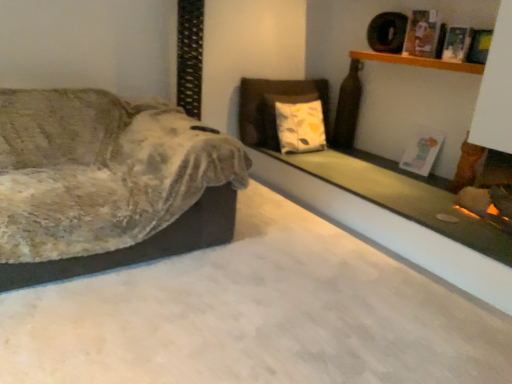
Question: Is velvet fabric couch at left to the right of green matte glass at upper right from the viewer's perspective?

Choices:
 (A) no
 (B) yes

Answer: (A)

Question: Considering the relative sizes of velvet fabric couch at left and green matte glass at upper right in the image provided, is velvet fabric couch at left smaller than green matte glass at upper right?

Choices:
 (A) no
 (B) yes

Answer: (A)

Question: Are velvet fabric couch at left and green matte glass at upper right located far from each other?

Choices:
 (A) yes
 (B) no

Answer: (A)

Question: Considering the relative positions of velvet fabric couch at left and green matte glass at upper right in the image provided, is velvet fabric couch at left to the left of green matte glass at upper right from the viewer's perspective?

Choices:
 (A) yes
 (B) no

Answer: (A)

Question: Considering the relative sizes of velvet fabric couch at left and green matte glass at upper right in the image provided, is velvet fabric couch at left shorter than green matte glass at upper right?

Choices:
 (A) yes
 (B) no

Answer: (B)

Question: Does velvet fabric couch at left have a greater height compared to green matte glass at upper right?

Choices:
 (A) yes
 (B) no

Answer: (A)

Question: Is velvet fabric couch at left not within wooden shelf at upper right?

Choices:
 (A) no
 (B) yes

Answer: (B)

Question: Is the position of velvet fabric couch at left less distant than that of wooden shelf at upper right?

Choices:
 (A) yes
 (B) no

Answer: (A)

Question: Considering the relative sizes of velvet fabric couch at left and wooden shelf at upper right in the image provided, is velvet fabric couch at left bigger than wooden shelf at upper right?

Choices:
 (A) no
 (B) yes

Answer: (B)

Question: Is velvet fabric couch at left next to wooden shelf at upper right and touching it?

Choices:
 (A) yes
 (B) no

Answer: (B)

Question: Does velvet fabric couch at left appear on the right side of wooden shelf at upper right?

Choices:
 (A) no
 (B) yes

Answer: (A)

Question: Does velvet fabric couch at left turn towards wooden shelf at upper right?

Choices:
 (A) yes
 (B) no

Answer: (B)

Question: From the image's perspective, is green matte glass at upper right on top of velvet fabric couch at left?

Choices:
 (A) yes
 (B) no

Answer: (B)